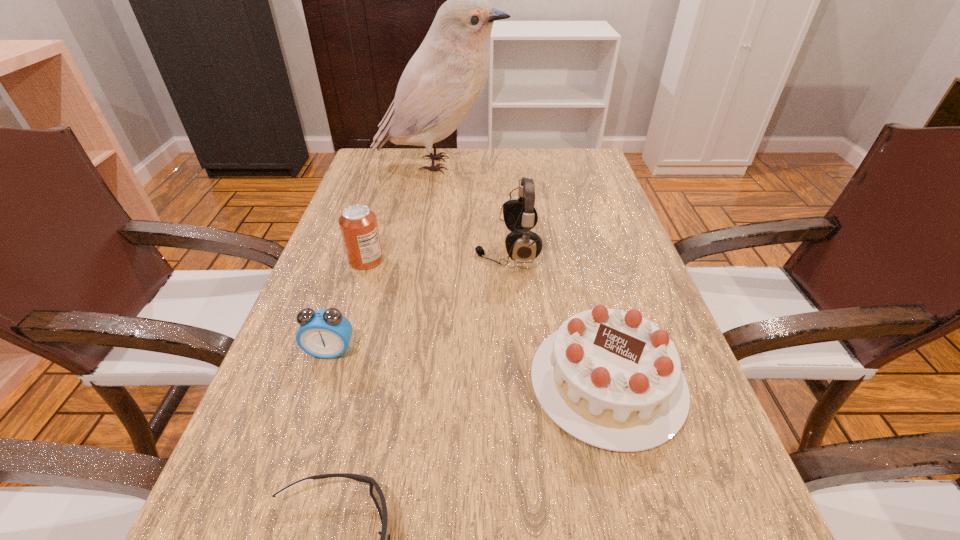
Find the location of a particular element. This screenshot has width=960, height=540. the tallest object is located at coordinates (441, 83).

The width and height of the screenshot is (960, 540). Find the location of `parakeet`. parakeet is located at coordinates (441, 83).

Where is `the second tallest object`? the second tallest object is located at coordinates (522, 245).

This screenshot has height=540, width=960. Identify the location of can. (358, 224).

Identify the location of birthday cake. (612, 379).

What are the coordinates of `alarm clock` in the screenshot? It's located at (324, 333).

The height and width of the screenshot is (540, 960). In order to click on vacant space situated on the face of the tallest object in this screenshot , I will do `click(528, 164)`.

Find the location of a particular element. vacant space positioned 0.210m with the microphone on the side of the headset is located at coordinates (386, 249).

Image resolution: width=960 pixels, height=540 pixels. I want to click on free space located with the microphone on the side of the headset, so pos(386,249).

Where is `free spot located 0.290m with the microphone on the side of the headset`? The image size is (960, 540). free spot located 0.290m with the microphone on the side of the headset is located at coordinates (352, 249).